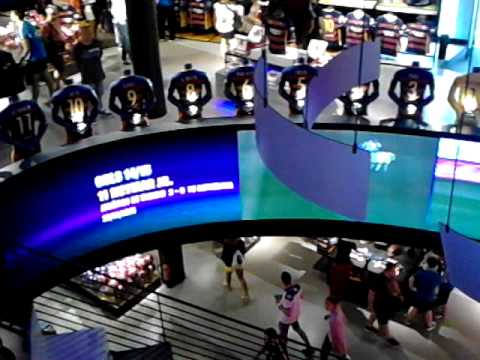
In order to click on left screen in this screenshot , I will do `click(111, 179)`.